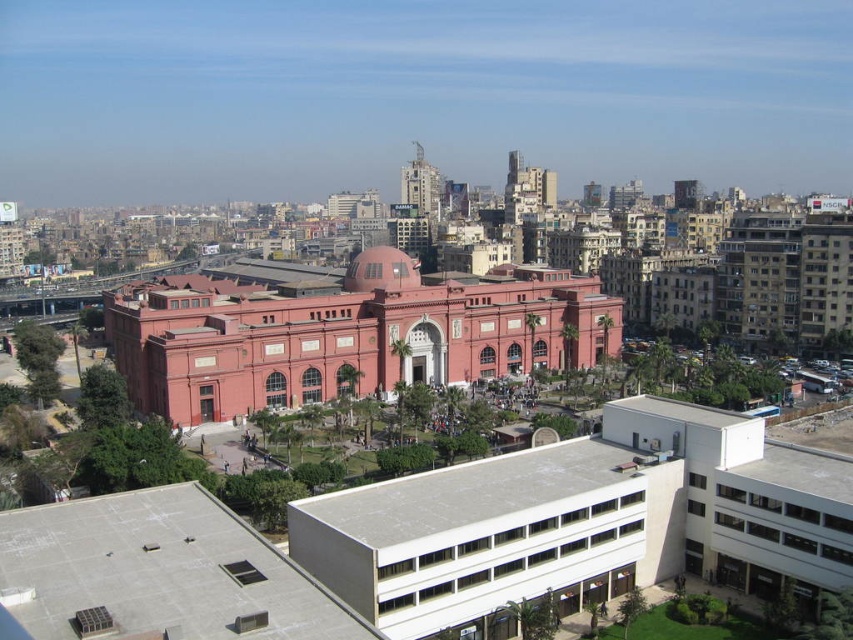
Question: Is matte red building at center bigger than matte red dome at center?

Choices:
 (A) no
 (B) yes

Answer: (B)

Question: Among these objects, which one is nearest to the camera?

Choices:
 (A) matte red building at center
 (B) matte red dome at center

Answer: (A)

Question: Among these points, which one is farthest from the camera?

Choices:
 (A) (503, 352)
 (B) (398, 259)

Answer: (A)

Question: Among these points, which one is nearest to the camera?

Choices:
 (A) (378, 342)
 (B) (386, 257)

Answer: (A)

Question: Is matte red building at center in front of matte red dome at center?

Choices:
 (A) yes
 (B) no

Answer: (A)

Question: Is matte red building at center bigger than matte red dome at center?

Choices:
 (A) yes
 (B) no

Answer: (A)